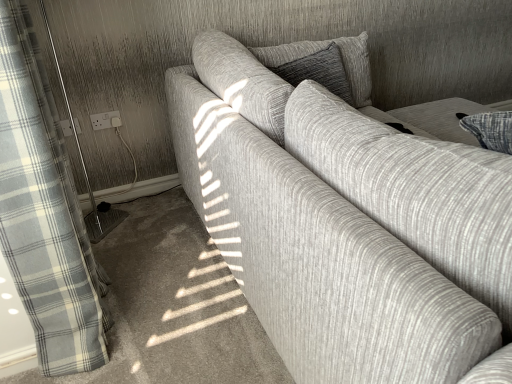
Question: Can you confirm if textured gray couch at center is taller than textured gray pillow at center?

Choices:
 (A) no
 (B) yes

Answer: (B)

Question: Does textured gray couch at center appear on the left side of textured gray pillow at center?

Choices:
 (A) yes
 (B) no

Answer: (B)

Question: Can you confirm if textured gray couch at center is thinner than textured gray pillow at center?

Choices:
 (A) yes
 (B) no

Answer: (B)

Question: From the image's perspective, is textured gray couch at center located beneath textured gray pillow at center?

Choices:
 (A) yes
 (B) no

Answer: (A)

Question: Is textured gray couch at center smaller than textured gray pillow at center?

Choices:
 (A) yes
 (B) no

Answer: (B)

Question: Visually, is textured gray pillow at center positioned to the left or to the right of white plastic socket at lower left, which is counted as the 2th electric outlet, starting from the right?

Choices:
 (A) right
 (B) left

Answer: (A)

Question: In the image, is textured gray pillow at center positioned in front of or behind white plastic socket at lower left, the first electric outlet when ordered from left to right?

Choices:
 (A) front
 (B) behind

Answer: (A)

Question: From a real-world perspective, is textured gray pillow at center positioned above or below white plastic socket at lower left, which is counted as the 2th electric outlet, starting from the right?

Choices:
 (A) above
 (B) below

Answer: (A)

Question: From the image's perspective, is textured gray pillow at center located above or below white plastic socket at lower left, the first electric outlet when ordered from left to right?

Choices:
 (A) above
 (B) below

Answer: (A)

Question: Considering the positions of white plastic socket at lower left, which is counted as the 2th electric outlet, starting from the right, and textured gray pillow at center in the image, is white plastic socket at lower left, which is counted as the 2th electric outlet, starting from the right, taller or shorter than textured gray pillow at center?

Choices:
 (A) short
 (B) tall

Answer: (A)

Question: Is white plastic socket at lower left, which is counted as the 2th electric outlet, starting from the right, inside the boundaries of textured gray pillow at center, or outside?

Choices:
 (A) outside
 (B) inside

Answer: (A)

Question: Is point (66, 134) positioned closer to the camera than point (360, 64)?

Choices:
 (A) closer
 (B) farther

Answer: (B)

Question: In the image, is white plastic socket at lower left, the first electric outlet when ordered from left to right, on the left side or the right side of textured gray pillow at center?

Choices:
 (A) right
 (B) left

Answer: (B)

Question: Considering the positions of white textured screen door at left and white plastic socket at upper left, acting as the second electric outlet starting from the left, in the image, is white textured screen door at left bigger or smaller than white plastic socket at upper left, acting as the second electric outlet starting from the left,?

Choices:
 (A) big
 (B) small

Answer: (A)

Question: Is white textured screen door at left inside the boundaries of white plastic socket at upper left, which appears as the first electric outlet when viewed from the right, or outside?

Choices:
 (A) outside
 (B) inside

Answer: (A)